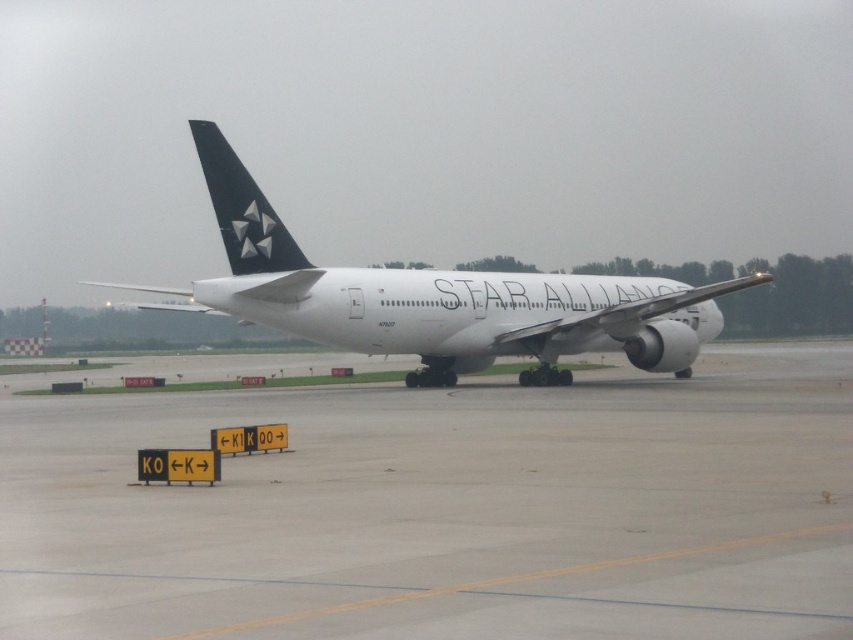
Is gray concrete tarmac at center smaller than white matte airplane at center?

Yes.

Between point (440, 573) and point (624, 307), which one is positioned in front?

Point (440, 573)

Locate an element on the screen. gray concrete tarmac at center is located at coordinates (447, 509).